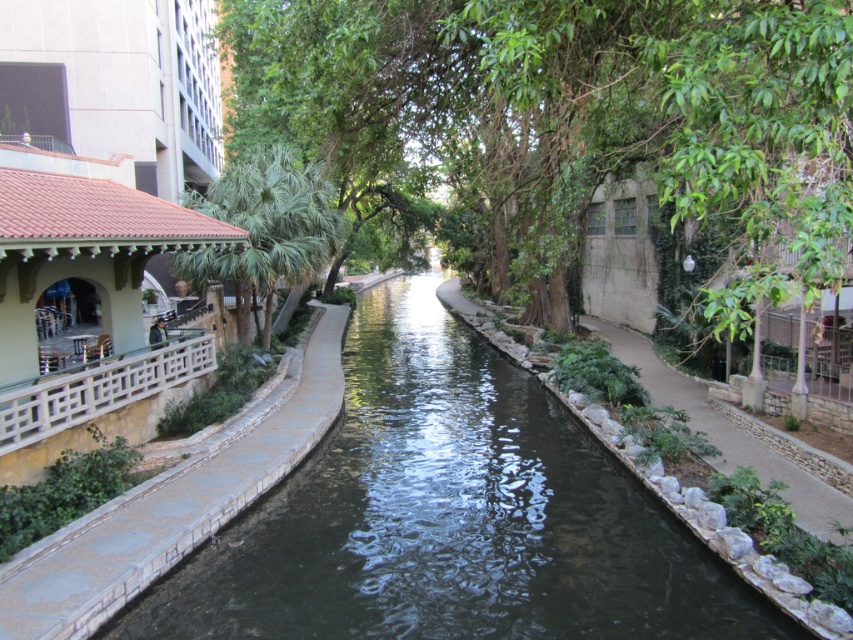
Can you confirm if green leafy tree at center is wider than green stone wall at right?

Indeed, green leafy tree at center has a greater width compared to green stone wall at right.

Does green leafy tree at center have a lesser height compared to green stone wall at right?

No, green leafy tree at center is not shorter than green stone wall at right.

The height and width of the screenshot is (640, 853). What are the coordinates of `green leafy tree at center` in the screenshot? It's located at (573, 124).

The height and width of the screenshot is (640, 853). In order to click on green leafy tree at left in this screenshot , I will do `click(264, 230)`.

Describe the element at coordinates (264, 230) in the screenshot. I see `green leafy tree at left` at that location.

Is point (276, 188) farther from viewer compared to point (642, 342)?

No, it is in front of (642, 342).

In order to click on green leafy tree at left in this screenshot , I will do `click(264, 230)`.

Can you confirm if dark concrete stream at center is positioned below green leafy tree at left?

Correct, dark concrete stream at center is located below green leafy tree at left.

Who is shorter, dark concrete stream at center or green leafy tree at left?

dark concrete stream at center is shorter.

At what (x,y) coordinates should I click in order to perform the action: click on dark concrete stream at center. Please return your answer as a coordinate pair (x, y). Looking at the image, I should click on (450, 516).